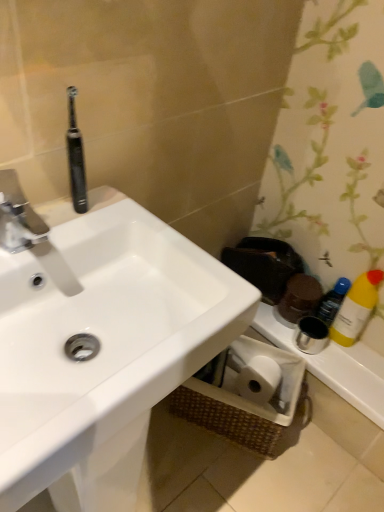
Where is `empty space that is ontop of white plastic toilet paper holder at lower right (from a real-world perspective)`? empty space that is ontop of white plastic toilet paper holder at lower right (from a real-world perspective) is located at coordinates (338, 350).